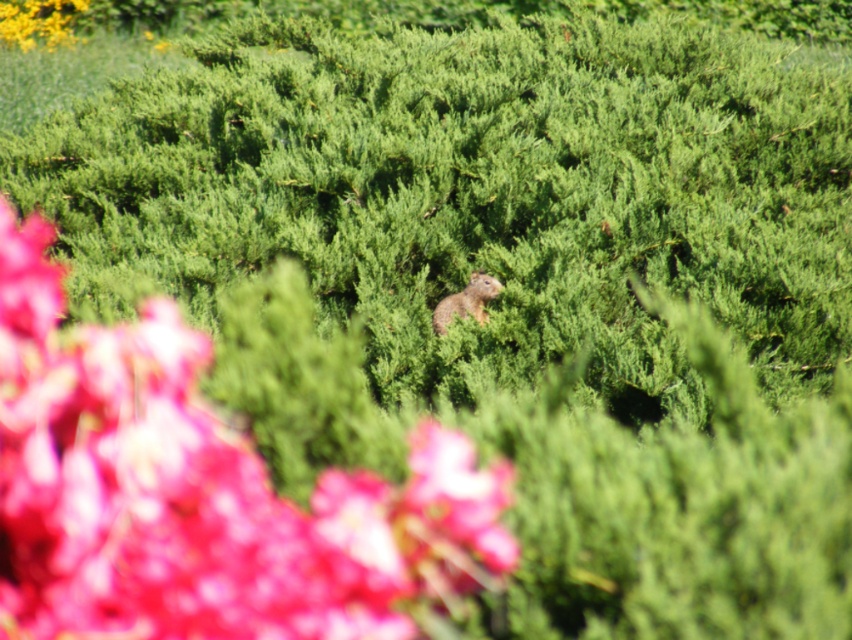
Question: Which point is farther to the camera?

Choices:
 (A) yellow textured flower at upper left
 (B) furry brown squirrel at center

Answer: (A)

Question: Can you confirm if yellow textured flower at upper left is bigger than furry brown squirrel at center?

Choices:
 (A) no
 (B) yes

Answer: (B)

Question: Which object appears closest to the camera in this image?

Choices:
 (A) furry brown squirrel at center
 (B) matte pink petals at center
 (C) yellow textured flower at upper left

Answer: (B)

Question: Does yellow textured flower at upper left have a lesser width compared to furry brown squirrel at center?

Choices:
 (A) no
 (B) yes

Answer: (A)

Question: Does matte pink petals at center have a lesser width compared to furry brown squirrel at center?

Choices:
 (A) yes
 (B) no

Answer: (B)

Question: Which of these objects is positioned closest to the yellow textured flower at upper left?

Choices:
 (A) furry brown squirrel at center
 (B) matte pink petals at center

Answer: (B)